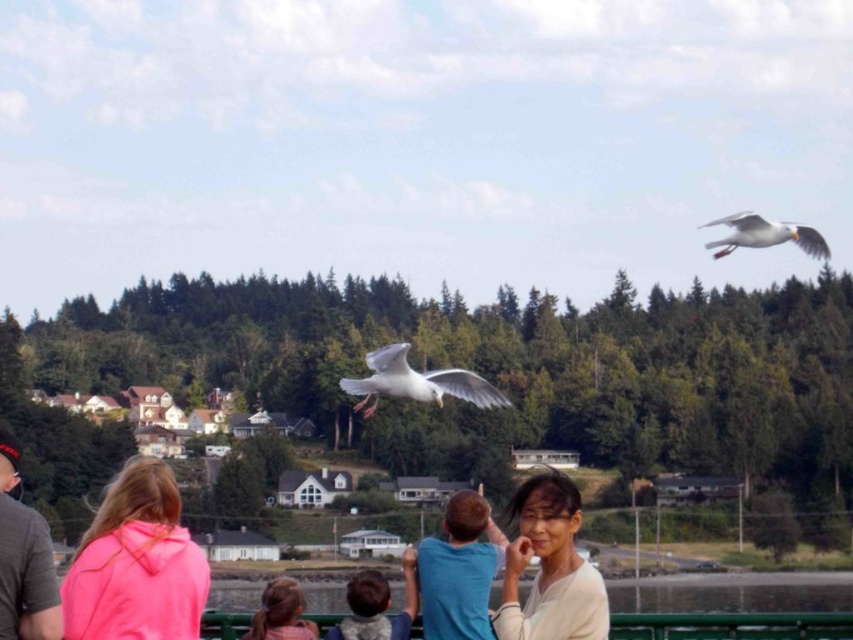
Based on the photo, is pink fleece jacket at lower left taller than white feathered bird at upper right?

Correct, pink fleece jacket at lower left is much taller as white feathered bird at upper right.

Is pink fleece jacket at lower left to the left of white feathered bird at upper right from the viewer's perspective?

Indeed, pink fleece jacket at lower left is positioned on the left side of white feathered bird at upper right.

Is point (148, 484) positioned before point (801, 234)?

That is True.

The width and height of the screenshot is (853, 640). Find the location of `pink fleece jacket at lower left`. pink fleece jacket at lower left is located at coordinates (136, 563).

Is green painted metal rail at lower center below white feathered bird at upper right?

Correct, green painted metal rail at lower center is located below white feathered bird at upper right.

In the scene shown: Can you confirm if green painted metal rail at lower center is thinner than white feathered bird at upper right?

No.

Locate an element on the screen. This screenshot has height=640, width=853. green painted metal rail at lower center is located at coordinates (732, 625).

Between smooth beige blouse at center and pink fabric at lower left, which one appears on the right side from the viewer's perspective?

smooth beige blouse at center is more to the right.

Between point (581, 570) and point (3, 506), which one is positioned behind?

The point (581, 570) is more distant.

Locate an element on the screen. smooth beige blouse at center is located at coordinates (549, 566).